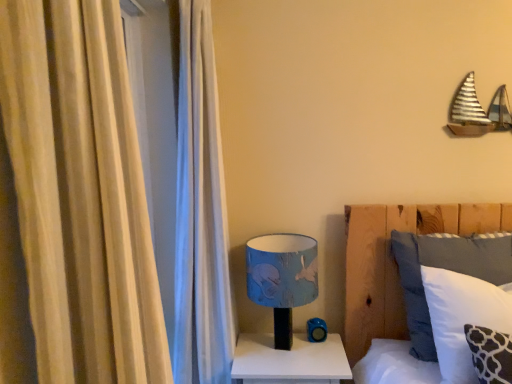
Image resolution: width=512 pixels, height=384 pixels. What do you see at coordinates (282, 278) in the screenshot?
I see `blue fabric lampshade at center` at bounding box center [282, 278].

This screenshot has width=512, height=384. What do you see at coordinates (289, 361) in the screenshot?
I see `white glossy nightstand at lower center` at bounding box center [289, 361].

This screenshot has height=384, width=512. Find the location of `white soft pillow at center`. white soft pillow at center is located at coordinates (394, 262).

Describe the element at coordinates (394, 262) in the screenshot. I see `white soft pillow at center` at that location.

Image resolution: width=512 pixels, height=384 pixels. Describe the element at coordinates (462, 318) in the screenshot. I see `white soft pillow at lower right` at that location.

Locate an element on the screen. This screenshot has height=384, width=512. blue fabric lampshade at center is located at coordinates (282, 278).

Is white glossy nightstand at lower center in contact with beige fabric curtain at left?

No, white glossy nightstand at lower center is not making contact with beige fabric curtain at left.

Considering the sizes of objects white glossy nightstand at lower center and beige fabric curtain at left in the image provided, who is thinner, white glossy nightstand at lower center or beige fabric curtain at left?

beige fabric curtain at left.

Is white glossy nightstand at lower center looking in the opposite direction of beige fabric curtain at left?

That's not correct — white glossy nightstand at lower center is not looking away from beige fabric curtain at left.

Considering the sizes of objects white soft pillow at center and blue fabric lampshade at center in the image provided, who is thinner, white soft pillow at center or blue fabric lampshade at center?

white soft pillow at center.

In order to click on bed that appears in front of the blue fabric lampshade at center in this screenshot , I will do `click(394, 262)`.

Are white soft pillow at center and blue fabric lampshade at center located far from each other?

They are positioned close to each other.

From the image's perspective, which object appears higher, white soft pillow at center or blue fabric lampshade at center?

white soft pillow at center appears higher in the image.

Is point (275, 327) farther from camera compared to point (112, 182)?

That is True.

Is blue fabric lampshade at center facing away from beige fabric curtain at left?

No, blue fabric lampshade at center is not facing the opposite direction of beige fabric curtain at left.

Is beige fabric curtain at left completely or partially inside blue fabric lampshade at center?

No, blue fabric lampshade at center does not contain beige fabric curtain at left.

From the picture: Would you consider blue fabric lampshade at center to be distant from beige fabric curtain at left?

Yes, blue fabric lampshade at center is far from beige fabric curtain at left.

Is the surface of white soft pillow at lower right in direct contact with blue fabric lampshade at center?

No, white soft pillow at lower right is not next to blue fabric lampshade at center.

Considering the sizes of white soft pillow at lower right and blue fabric lampshade at center in the image, is white soft pillow at lower right taller or shorter than blue fabric lampshade at center?

Considering their sizes, white soft pillow at lower right has less height than blue fabric lampshade at center.

Considering the positions of point (438, 356) and point (304, 249), is point (438, 356) closer or farther from the camera than point (304, 249)?

Point (438, 356) is closer to the camera than point (304, 249).

From a real-world perspective, which object stands above the other?

blue fabric lampshade at center is physically above.

Is white soft pillow at center positioned with its back to beige fabric curtain at left?

No, white soft pillow at center's orientation is not away from beige fabric curtain at left.

Which of these two, white soft pillow at center or beige fabric curtain at left, is wider?

white soft pillow at center is wider.

How distant is white soft pillow at center from beige fabric curtain at left?

A distance of 4.61 feet exists between white soft pillow at center and beige fabric curtain at left.

Can you confirm if white soft pillow at center is smaller than beige fabric curtain at left?

Yes.

Is white glossy nightstand at lower center inside or outside of blue fabric lampshade at center?

The correct answer is: outside.

Is white glossy nightstand at lower center far from blue fabric lampshade at center?

white glossy nightstand at lower center is near blue fabric lampshade at center, not far away.

From their relative heights in the image, would you say white glossy nightstand at lower center is taller or shorter than blue fabric lampshade at center?

Clearly, white glossy nightstand at lower center is shorter compared to blue fabric lampshade at center.

Can you confirm if white glossy nightstand at lower center is bigger than blue fabric lampshade at center?

Yes.

Based on the photo, which object is positioned more to the left, blue fabric lampshade at center or white soft pillow at center?

blue fabric lampshade at center.

Which of these two, blue fabric lampshade at center or white soft pillow at center, stands shorter?

blue fabric lampshade at center.

From the image's perspective, is blue fabric lampshade at center on top of white soft pillow at center?

No.

Can you tell me how much blue fabric lampshade at center and white soft pillow at center differ in facing direction?

There is a 0.275-degree angle between the facing directions of blue fabric lampshade at center and white soft pillow at center.

The height and width of the screenshot is (384, 512). I want to click on curtain to the left of white glossy nightstand at lower center, so click(x=80, y=194).

At what (x,y) coordinates should I click in order to perform the action: click on bed in front of the blue fabric lampshade at center. Please return your answer as a coordinate pair (x, y). Looking at the image, I should click on (394, 262).

Estimate the real-world distances between objects in this image. Which object is closer to blue fabric lampshade at center, white soft pillow at center or white soft pillow at lower right?

white soft pillow at center lies closer to blue fabric lampshade at center than the other object.

Based on their spatial positions, is white soft pillow at center or white glossy nightstand at lower center further from white soft pillow at lower right?

Based on the image, white glossy nightstand at lower center appears to be further to white soft pillow at lower right.

Considering their positions, is blue fabric lampshade at center positioned closer to beige fabric curtain at left than white glossy nightstand at lower center?

Among the two, blue fabric lampshade at center is located nearer to beige fabric curtain at left.

When comparing their distances from beige fabric curtain at left, does white soft pillow at lower right or white soft pillow at center seem further?

white soft pillow at center is further to beige fabric curtain at left.

Looking at the image, which one is located further to white glossy nightstand at lower center, beige fabric curtain at left or blue fabric lampshade at center?

beige fabric curtain at left is further to white glossy nightstand at lower center.

When comparing their distances from blue fabric lampshade at center, does white soft pillow at center or white glossy nightstand at lower center seem further?

white soft pillow at center lies further to blue fabric lampshade at center than the other object.

Looking at this image, considering their positions, is beige fabric curtain at left positioned further to blue fabric lampshade at center than white glossy nightstand at lower center?

Among the two, beige fabric curtain at left is located further to blue fabric lampshade at center.

Estimate the real-world distances between objects in this image. Which object is closer to blue fabric lampshade at center, beige fabric curtain at left or white soft pillow at lower right?

white soft pillow at lower right lies closer to blue fabric lampshade at center than the other object.

I want to click on nightstand situated between blue fabric lampshade at center and white soft pillow at lower right from left to right, so click(x=289, y=361).

Where is `bed located between beige fabric curtain at left and white glossy nightstand at lower center in the depth direction`? bed located between beige fabric curtain at left and white glossy nightstand at lower center in the depth direction is located at coordinates (394, 262).

Where is `nightstand between blue fabric lampshade at center and white soft pillow at center from left to right`? The image size is (512, 384). nightstand between blue fabric lampshade at center and white soft pillow at center from left to right is located at coordinates (289, 361).

Locate an element on the screen. Image resolution: width=512 pixels, height=384 pixels. pillow between beige fabric curtain at left and blue fabric lampshade at center along the z-axis is located at coordinates (462, 318).